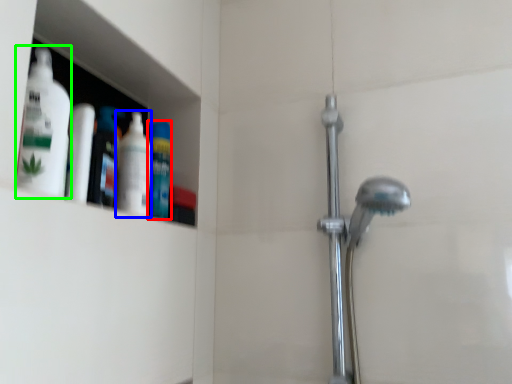
Question: Estimate the real-world distances between objects in this image. Which object is farther from mouthwash (highlighted by a red box), cleaning product (highlighted by a blue box) or cleaning product (highlighted by a green box)?

Choices:
 (A) cleaning product
 (B) cleaning product

Answer: (B)